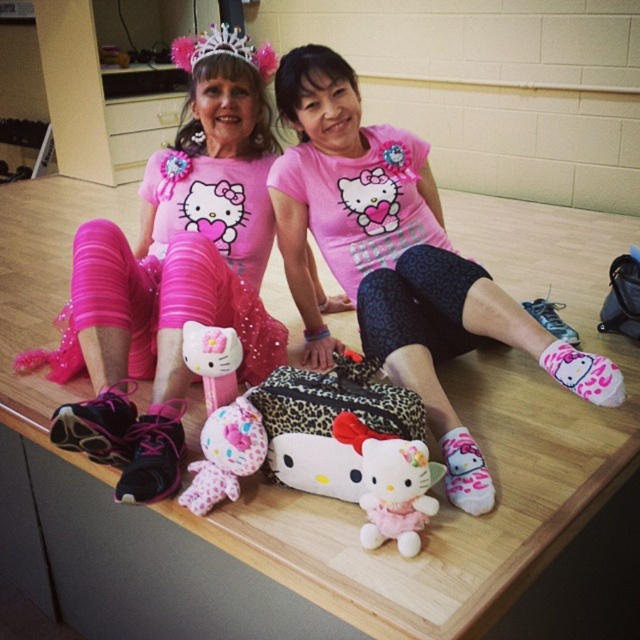
Question: Does pink sequined dress at left come in front of fluffy pink plush at center?

Choices:
 (A) yes
 (B) no

Answer: (B)

Question: Observing the image, what is the correct spatial positioning of fluffy pink plush at center in reference to feathered pink tiara at upper center?

Choices:
 (A) right
 (B) left

Answer: (A)

Question: Estimate the real-world distances between objects in this image. Which object is farther from the pink matte hello kitty shirt at center?

Choices:
 (A) feathered pink tiara at upper center
 (B) fluffy plush toy at center

Answer: (A)

Question: Which of the following is the farthest from the observer?

Choices:
 (A) (157, 445)
 (B) (236, 45)
 (C) (284, 60)

Answer: (B)

Question: Is pink matte hello kitty plush at center to the right of pink matte hello kitty shirt at center from the viewer's perspective?

Choices:
 (A) yes
 (B) no

Answer: (B)

Question: Which object appears closest to the camera in this image?

Choices:
 (A) pink fabric tiara at upper center
 (B) fluffy pink plush at center
 (C) pink sequined dress at left
 (D) matte plastic hello kitty toy at center

Answer: (B)